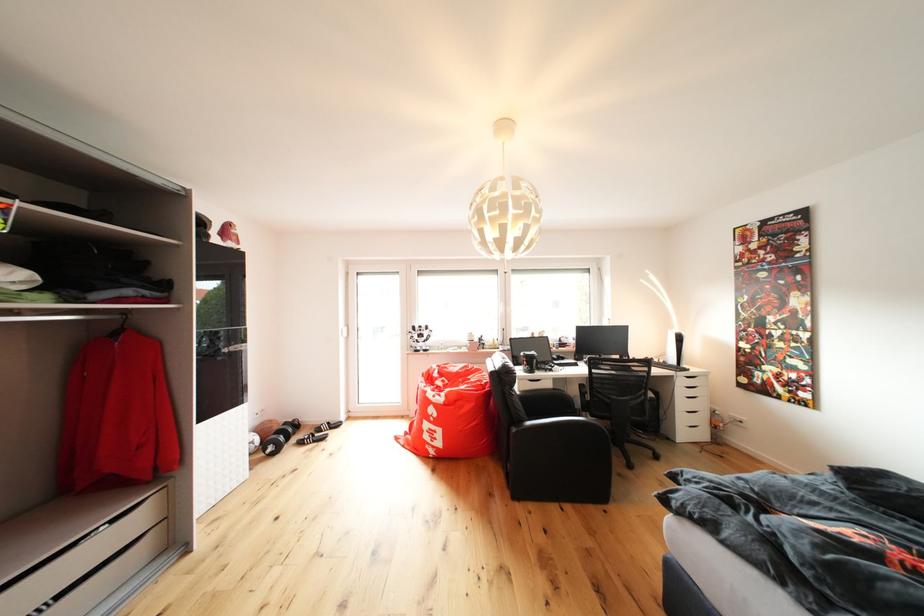
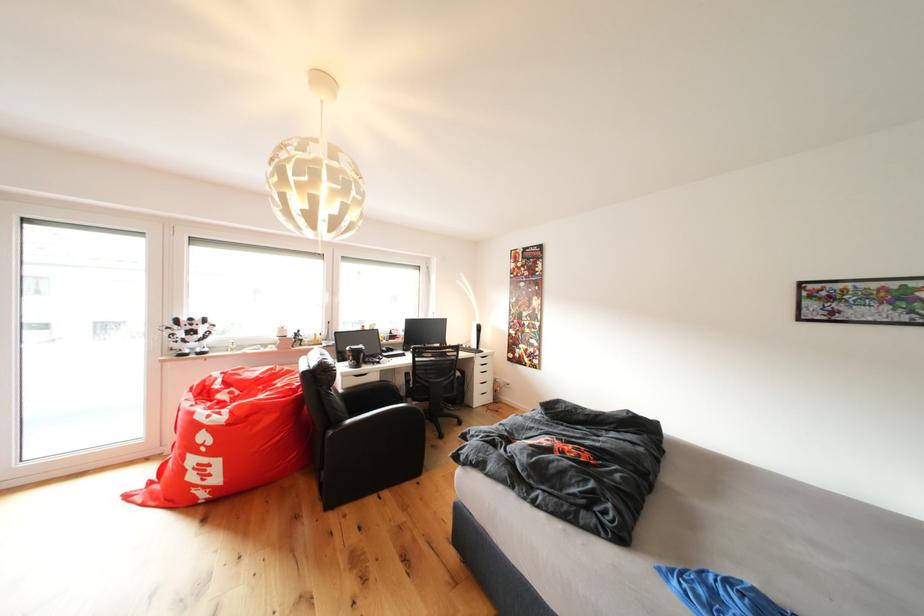
Find the pixel in the second image that matches (x=689, y=387) in the first image.

(487, 366)